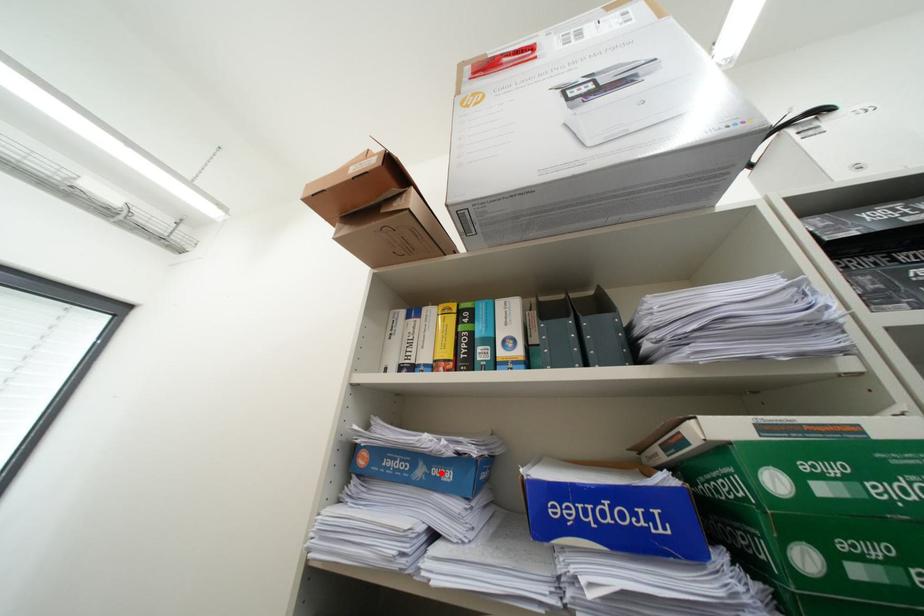
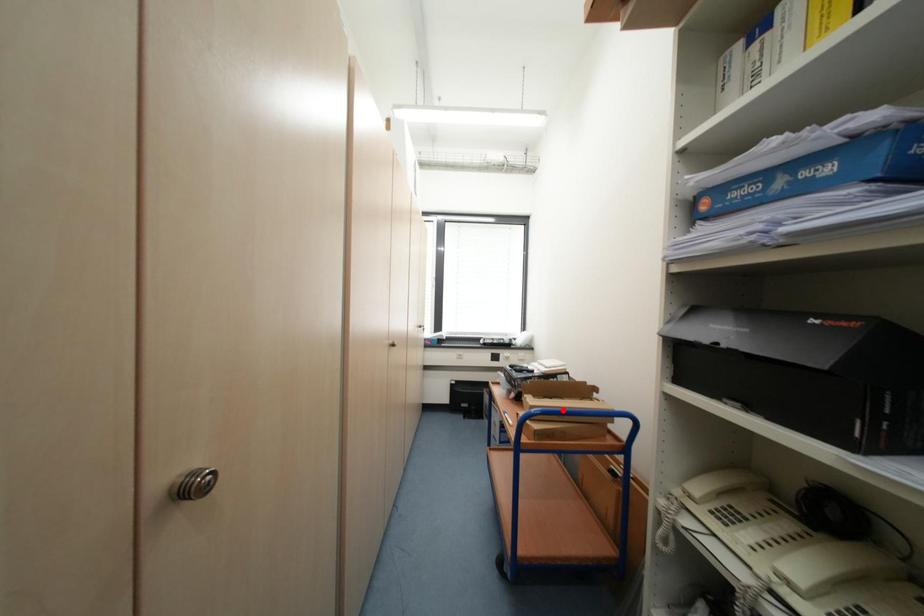
I am providing you with two images of the same scene from different viewpoints. A red point is marked on the first image and another point is marked on the second image. Is the marked point in image1 the same physical position as the marked point in image2?

No